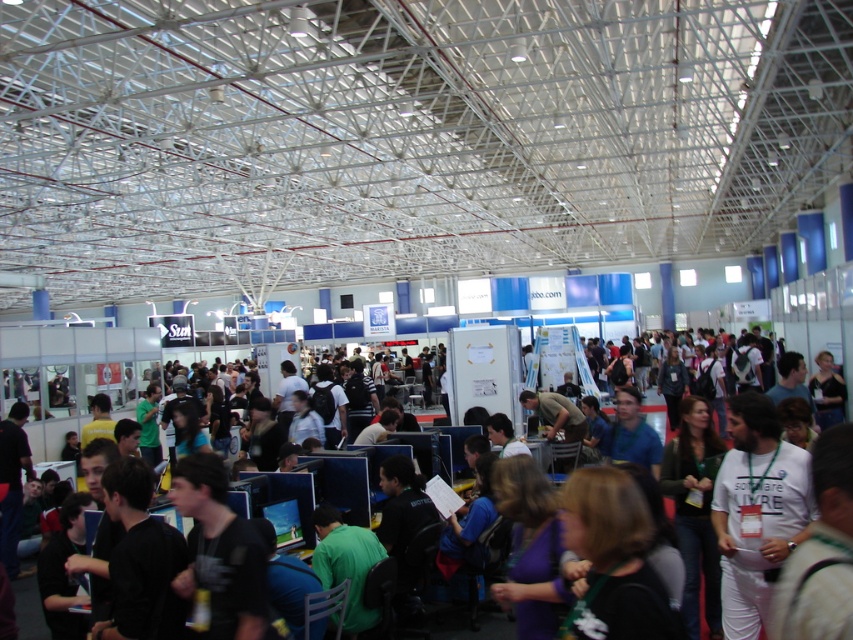
Question: Where is white matte t-shirt at center-right located in relation to dark blue shirt at center in the image?

Choices:
 (A) below
 (B) above

Answer: (A)

Question: Which of the following is the closest to the observer?

Choices:
 (A) white matte t-shirt at center-right
 (B) dark blue shirt at center

Answer: (A)

Question: Is white matte t-shirt at center-right thinner than dark blue shirt at center?

Choices:
 (A) yes
 (B) no

Answer: (A)

Question: Does white matte t-shirt at center-right have a smaller size compared to dark blue shirt at center?

Choices:
 (A) no
 (B) yes

Answer: (B)

Question: Which object appears closest to the camera in this image?

Choices:
 (A) dark blue shirt at center
 (B) white matte t-shirt at center-right

Answer: (B)